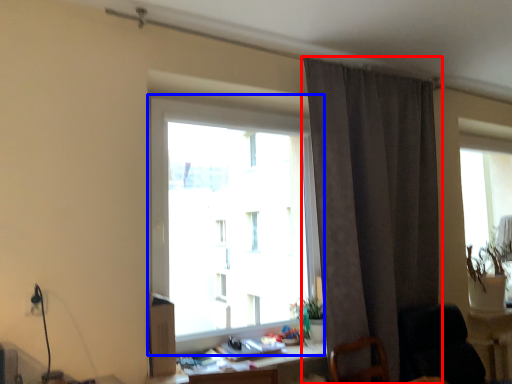
Question: Among these objects, which one is farthest to the camera, curtain (highlighted by a red box) or window (highlighted by a blue box)?

Choices:
 (A) curtain
 (B) window

Answer: (A)